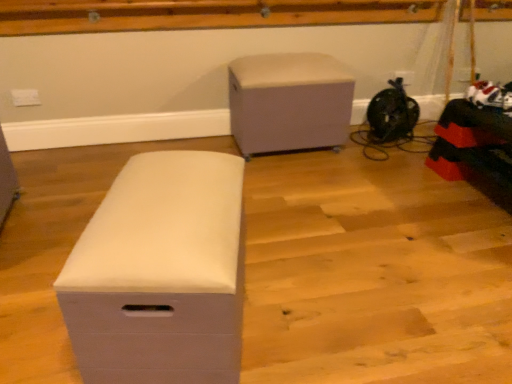
Question: Should I look upward or downward to see matte white storage box at center, marked as the 2th furniture in a back-to-front arrangement?

Choices:
 (A) up
 (B) down

Answer: (B)

Question: Is matte white storage box at center, which is counted as the second furniture, starting from the top, at the left side of beige fabric ottoman at center, acting as the 1th furniture starting from the top?

Choices:
 (A) no
 (B) yes

Answer: (B)

Question: Is matte white storage box at center, which is counted as the second furniture, starting from the top, closer to the viewer compared to beige fabric ottoman at center, which appears as the first furniture when viewed from the back?

Choices:
 (A) yes
 (B) no

Answer: (A)

Question: Considering the relative positions of matte white storage box at center, which is counted as the second furniture, starting from the top, and beige fabric ottoman at center, which appears as the first furniture when viewed from the back, in the image provided, is matte white storage box at center, which is counted as the second furniture, starting from the top, to the right of beige fabric ottoman at center, which appears as the first furniture when viewed from the back, from the viewer's perspective?

Choices:
 (A) no
 (B) yes

Answer: (A)

Question: Can you confirm if matte white storage box at center, which is counted as the second furniture, starting from the top, is taller than beige fabric ottoman at center, which appears as the first furniture when viewed from the back?

Choices:
 (A) yes
 (B) no

Answer: (B)

Question: Is matte white storage box at center, which is counted as the second furniture, starting from the top, aimed at beige fabric ottoman at center, which is the second furniture from front to back?

Choices:
 (A) no
 (B) yes

Answer: (A)

Question: From the image's perspective, would you say matte white storage box at center, the first furniture in the front-to-back sequence, is shown under beige fabric ottoman at center, marked as the 1th furniture in a right-to-left arrangement?

Choices:
 (A) yes
 (B) no

Answer: (A)

Question: Is beige fabric ottoman at center, acting as the 1th furniture starting from the top, oriented away from matte white storage box at center, which is counted as the second furniture, starting from the top?

Choices:
 (A) yes
 (B) no

Answer: (B)

Question: Can matte white storage box at center, acting as the first furniture starting from the bottom, be found inside beige fabric ottoman at center, which appears as the first furniture when viewed from the back?

Choices:
 (A) no
 (B) yes

Answer: (A)

Question: Is beige fabric ottoman at center, which appears as the first furniture when viewed from the back, facing towards matte white storage box at center, the second furniture from the right?

Choices:
 (A) no
 (B) yes

Answer: (B)

Question: Is beige fabric ottoman at center, which is the second furniture from front to back, not inside matte white storage box at center, acting as the first furniture starting from the bottom?

Choices:
 (A) yes
 (B) no

Answer: (A)

Question: Considering the relative sizes of beige fabric ottoman at center, which is the second furniture from front to back, and matte white storage box at center, marked as the 2th furniture in a back-to-front arrangement, in the image provided, is beige fabric ottoman at center, which is the second furniture from front to back, bigger than matte white storage box at center, marked as the 2th furniture in a back-to-front arrangement,?

Choices:
 (A) no
 (B) yes

Answer: (B)

Question: Considering the relative positions of beige fabric ottoman at center, which is the second furniture from front to back, and matte white storage box at center, which is counted as the second furniture, starting from the top, in the image provided, is beige fabric ottoman at center, which is the second furniture from front to back, to the left of matte white storage box at center, which is counted as the second furniture, starting from the top, from the viewer's perspective?

Choices:
 (A) no
 (B) yes

Answer: (A)

Question: Considering the relative positions of beige fabric ottoman at center, acting as the 1th furniture starting from the top, and matte white storage box at center, marked as the 2th furniture in a back-to-front arrangement, in the image provided, is beige fabric ottoman at center, acting as the 1th furniture starting from the top, to the left or to the right of matte white storage box at center, marked as the 2th furniture in a back-to-front arrangement,?

Choices:
 (A) left
 (B) right

Answer: (B)